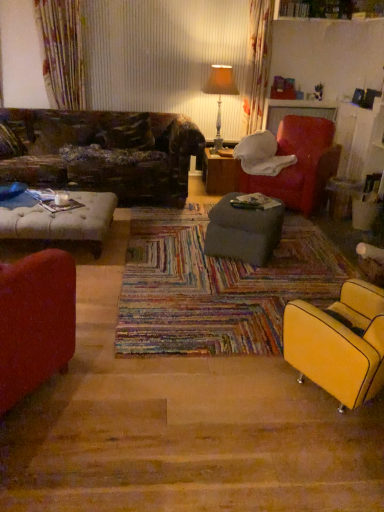
Image resolution: width=384 pixels, height=512 pixels. I want to click on vacant space that is to the left of gray fabric ottoman at center, arranged as the 2th table when viewed from the back, so click(177, 248).